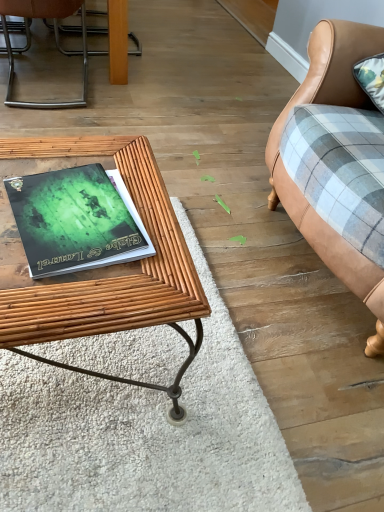
Where is `unoccupied region to the right of bambooobject at left`? Image resolution: width=384 pixels, height=512 pixels. unoccupied region to the right of bambooobject at left is located at coordinates (227, 385).